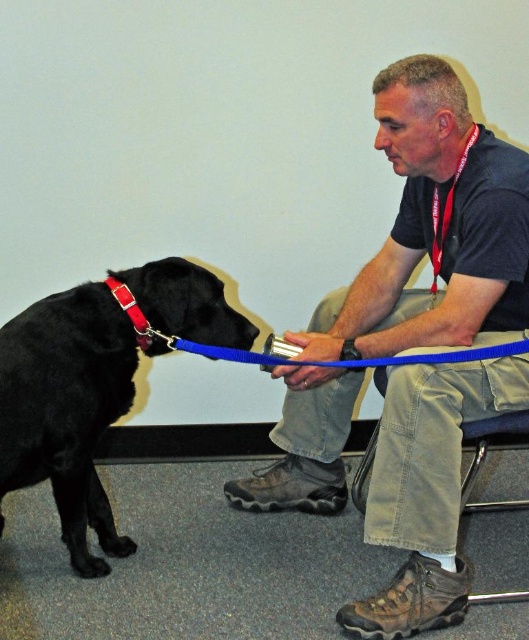
Question: Can you confirm if black matte dog at left is positioned below red nylon collar at left?

Choices:
 (A) yes
 (B) no

Answer: (A)

Question: Which of the following is the farthest from the observer?

Choices:
 (A) (59, 412)
 (B) (416, 442)

Answer: (A)

Question: Which object is closer to the camera taking this photo?

Choices:
 (A) blue rubber leash at center
 (B) black matte dog at left
 (C) matte black shirt at center

Answer: (C)

Question: Does matte black shirt at center have a smaller size compared to black matte dog at left?

Choices:
 (A) no
 (B) yes

Answer: (A)

Question: Is matte black shirt at center thinner than blue rubber leash at center?

Choices:
 (A) no
 (B) yes

Answer: (B)

Question: Which object appears farthest from the camera in this image?

Choices:
 (A) blue rubber leash at center
 (B) black matte dog at left
 (C) red nylon collar at left

Answer: (C)